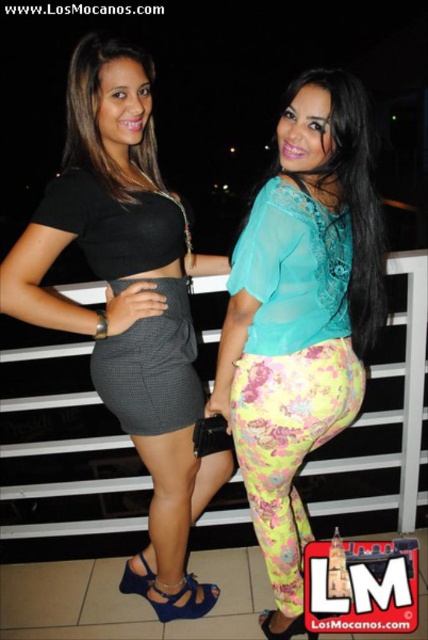
You are taking a photo of the two women in the scene. You want to focus on the point closer to the camera. Which point should you choose between point (154,419) and point (383,257)?

Point (154,419) is closer to the camera than point (383,257), so you should choose point (154,419).

You are a fashion designer analyzing the outfit of the woman on the left. You notice the gray checkered skirt at center and the translucent teal blouse at upper center. Which of these two items has a larger size?

The gray checkered skirt at center has a larger size compared to the translucent teal blouse at upper center.

You are a fashion designer observing two outfits in the image. The first is the translucent teal blouse at upper center, and the second is the matte black top at upper left. Which of these two outfits has a narrower width?

The translucent teal blouse at upper center has a narrower width than the matte black top at upper left according to the description.